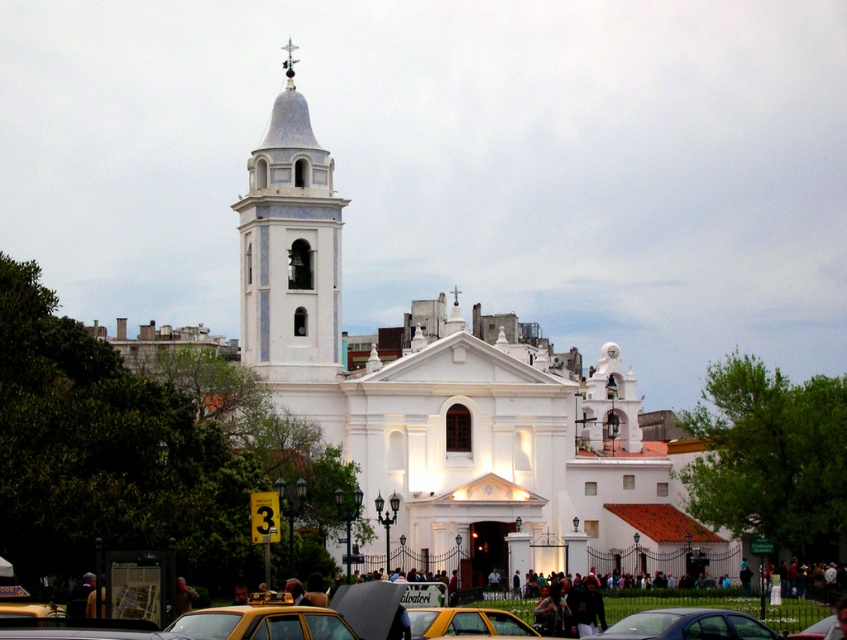
Question: Is white stucco bell tower at upper left to the left of yellow metallic car at center from the viewer's perspective?

Choices:
 (A) yes
 (B) no

Answer: (A)

Question: Which object is farther from the camera taking this photo?

Choices:
 (A) yellow rubber taxi at lower center
 (B) white stucco bell tower at upper left

Answer: (B)

Question: Based on their relative distances, which object is nearer to the metallic silver car at center?

Choices:
 (A) yellow matte taxi at lower center
 (B) white stucco bell tower at upper left

Answer: (A)

Question: Is white stucco bell tower at upper left below yellow matte taxi at lower center?

Choices:
 (A) no
 (B) yes

Answer: (A)

Question: Which object is closer to the camera taking this photo?

Choices:
 (A) yellow matte taxi at lower center
 (B) metallic silver car at center

Answer: (A)

Question: Can you confirm if white smooth church at center is positioned above white stucco bell tower at upper left?

Choices:
 (A) yes
 (B) no

Answer: (B)